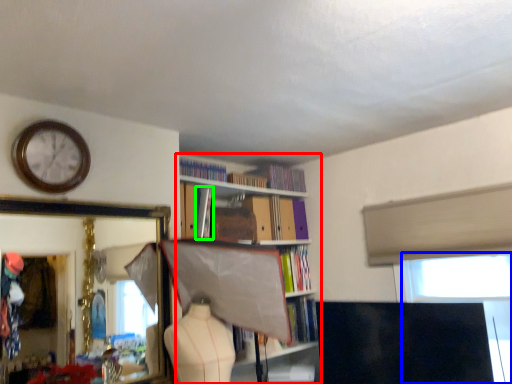
Question: Which is nearer to the bookcase (highlighted by a red box)? window screen (highlighted by a blue box) or book (highlighted by a green box).

Choices:
 (A) window screen
 (B) book

Answer: (B)